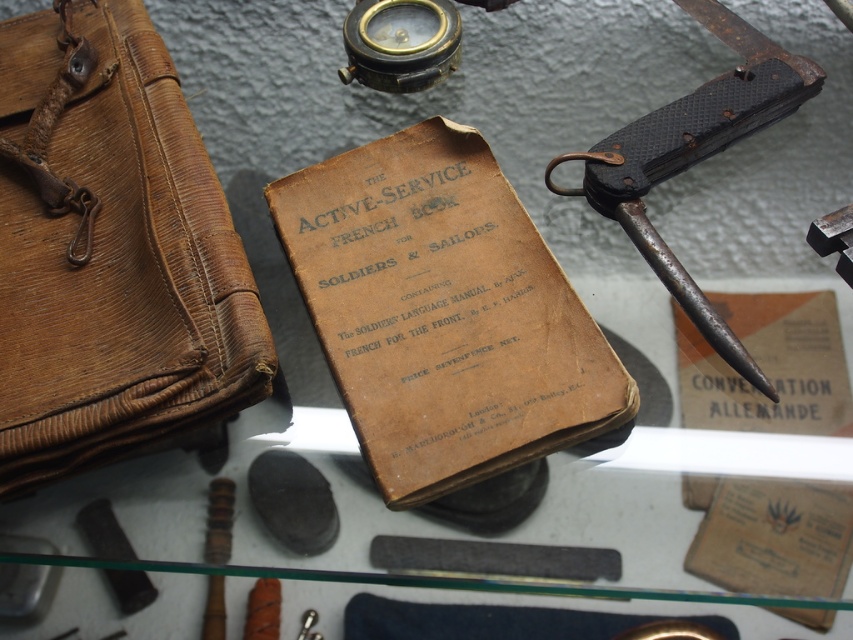
Which is above, brown leather briefcase at left or rusty metal knife at right?

rusty metal knife at right

Is brown leather briefcase at left below rusty metal knife at right?

Indeed, brown leather briefcase at left is positioned under rusty metal knife at right.

Which is in front, point (4, 301) or point (677, 116)?

Point (4, 301)

The height and width of the screenshot is (640, 853). What are the coordinates of `brown leather briefcase at left` in the screenshot? It's located at (109, 250).